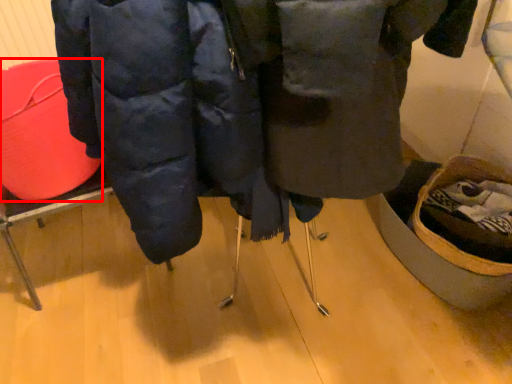
Question: Observing the image, what is the correct spatial positioning of basket (annotated by the red box) in reference to jacket?

Choices:
 (A) right
 (B) left

Answer: (B)